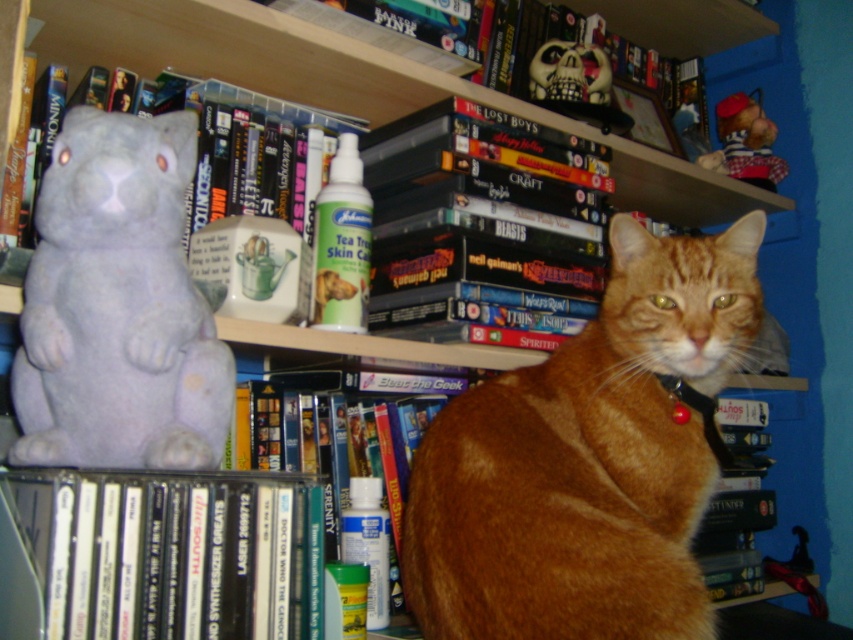
You are organizing a shelf and need to place a new item between the white ceramic bear at left and the red plastic collar at center. Which item should you place closer to the bear to maintain balance?

Since the white ceramic bear at left is larger than the red plastic collar at center, you should place the new item closer to the red plastic collar at center to balance the weight distribution on the shelf.

You are organizing a shelf and need to place the purple fabric stuffed animal at left and the red plastic collar at center. If you want to place them side by side without overlapping, which object should be placed first to ensure they both fit?

The purple fabric stuffed animal at left should be placed first because its width is larger than the red plastic collar at center, so placing the wider item first ensures both can fit side by side without overlapping.